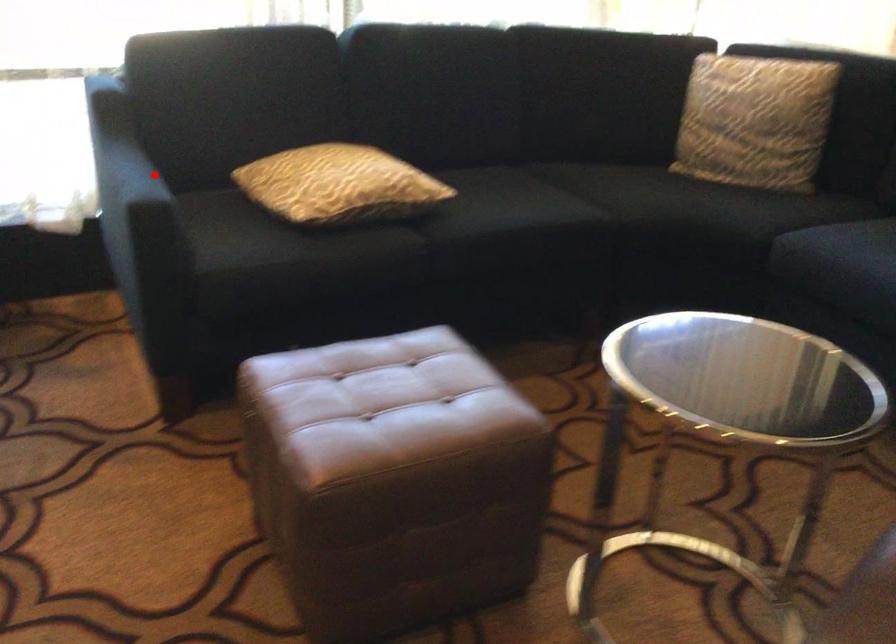
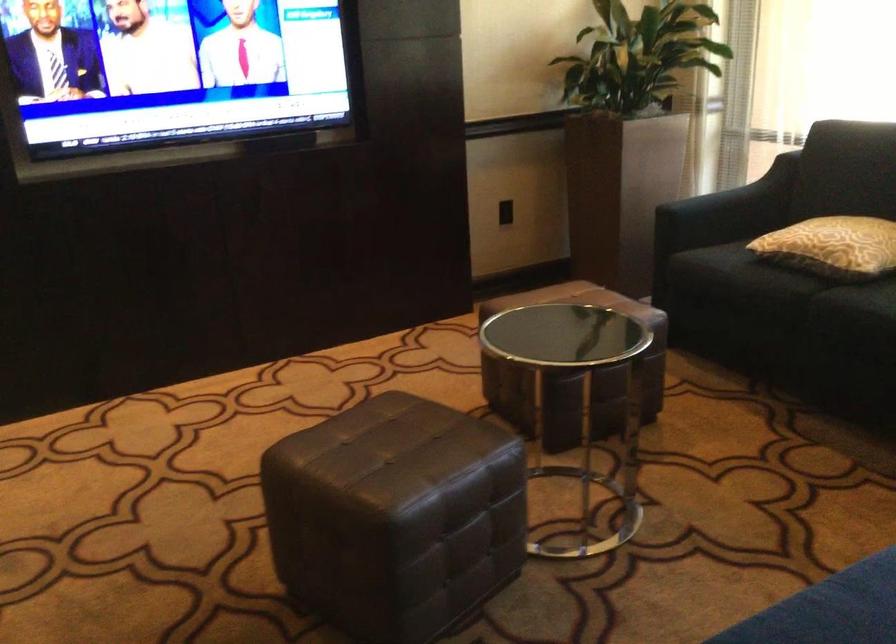
The point at the highlighted location is marked in the first image. Where is the corresponding point in the second image?

(742, 196)